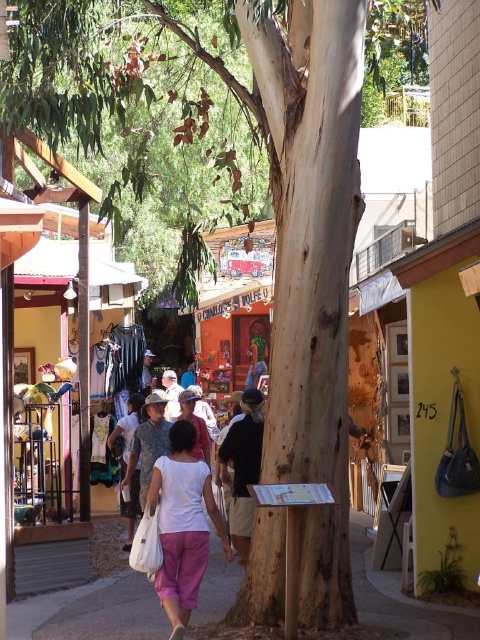
Question: Is smooth concrete sidewalk at center smaller than white cotton shirt at center?

Choices:
 (A) yes
 (B) no

Answer: (A)

Question: Which object appears farthest from the camera in this image?

Choices:
 (A) smooth concrete sidewalk at center
 (B) white cotton shirt at center

Answer: (A)

Question: Which point is closer to the camera?

Choices:
 (A) smooth concrete sidewalk at center
 (B) white cotton shirt at center

Answer: (B)

Question: Can you confirm if smooth concrete sidewalk at center is thinner than white cotton shirt at center?

Choices:
 (A) yes
 (B) no

Answer: (B)

Question: Is smooth concrete sidewalk at center smaller than white cotton shirt at center?

Choices:
 (A) no
 (B) yes

Answer: (B)